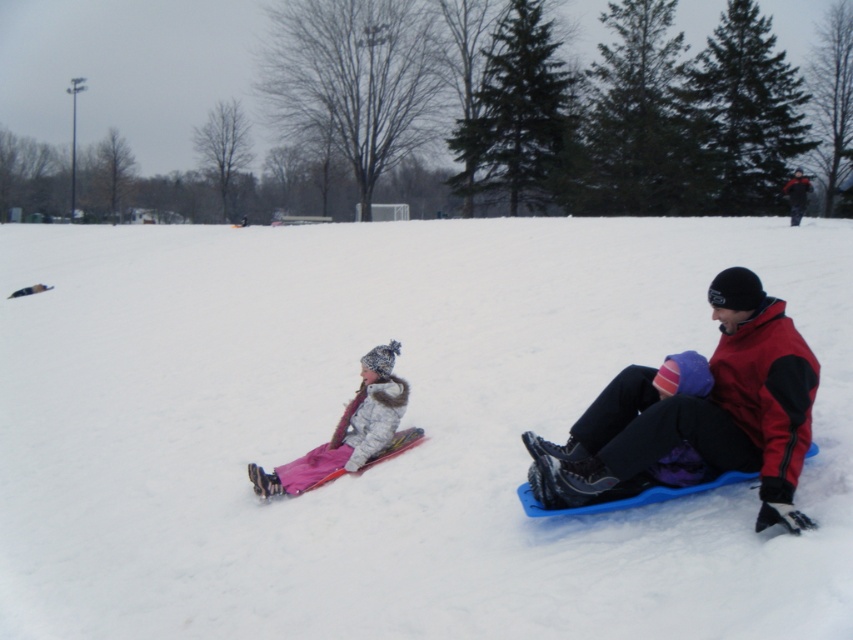
You are planning to build a snowman using the white fluffy snow at center and wearing the red fleece jacket at lower right. Which material has a greater width for building the base of the snowman?

The white fluffy snow at center has a greater width than the red fleece jacket at lower right, so it would be better for building the base of the snowman.

You are standing at the origin point of the coordinate system in the image. The red fleece jacket at lower right is located at coordinates. What are its coordinates?

The red fleece jacket at lower right is located at coordinates point (698, 413).